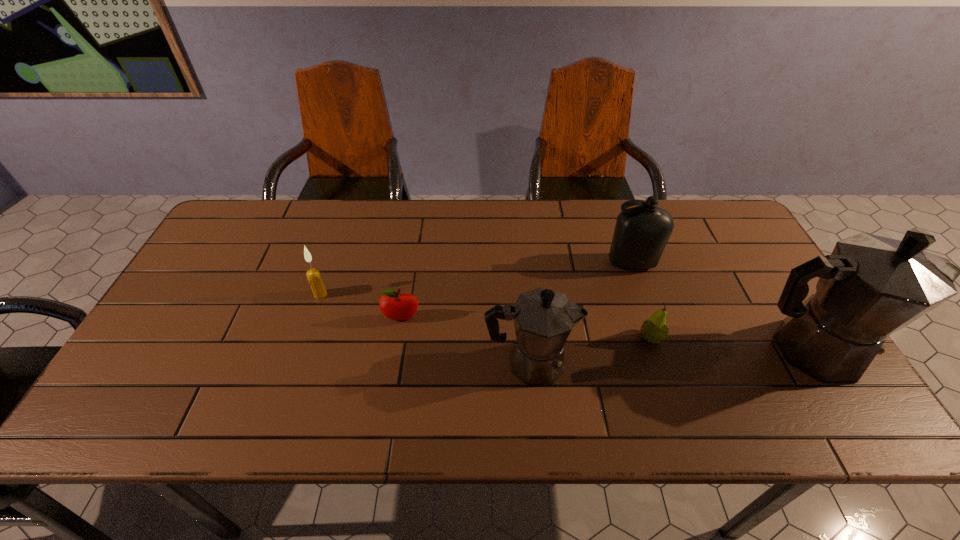
Locate an element on the screen. The height and width of the screenshot is (540, 960). the shorter coffeepot is located at coordinates (543, 319).

At what (x,y) coordinates should I click in order to perform the action: click on the third object from left to right. Please return your answer as a coordinate pair (x, y). Looking at the image, I should click on (543, 319).

The height and width of the screenshot is (540, 960). I want to click on the right coffeepot, so tap(871, 286).

Identify the location of the taller coffeepot. This screenshot has height=540, width=960. (871, 286).

This screenshot has width=960, height=540. I want to click on the fourth tallest object, so click(x=313, y=275).

Locate an element on the screen. The image size is (960, 540). candle is located at coordinates (313, 275).

The image size is (960, 540). Identify the location of the farthest object. (641, 233).

The width and height of the screenshot is (960, 540). What are the coordinates of `the second object from left to right` in the screenshot? It's located at (395, 306).

Identify the location of pear. (654, 330).

This screenshot has height=540, width=960. I want to click on vacant space located on the pouring side of the third object from left to right, so click(701, 363).